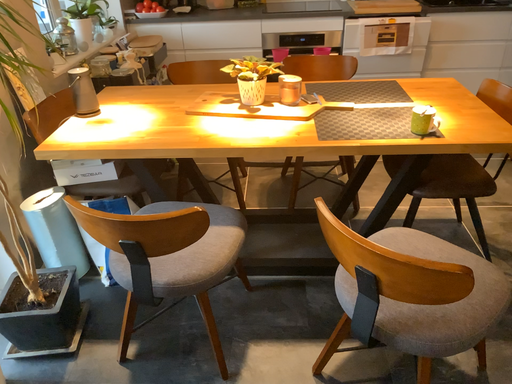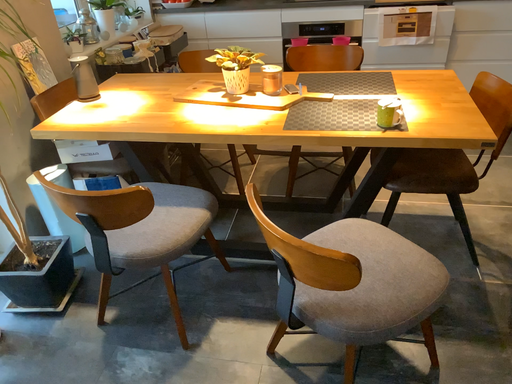
Question: How did the camera likely rotate when shooting the video?

Choices:
 (A) rotated left
 (B) rotated right

Answer: (A)